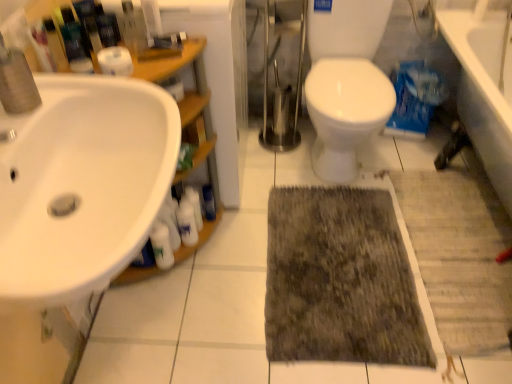
Find the location of a particular element. vacant area that lies between white glossy bottle at lower left, marked as the second toiletry in a right-to-left arrangement, and dark gray shaggy rug at center is located at coordinates (242, 252).